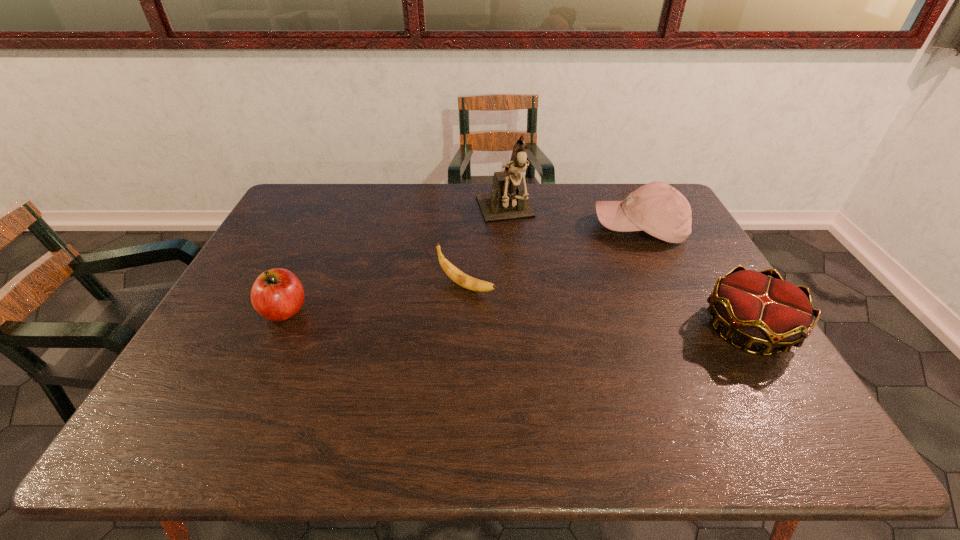
I want to click on baseball cap that is positioned at the right edge, so click(x=657, y=208).

At what (x,y) coordinates should I click in order to perform the action: click on object present at the far right corner. Please return your answer as a coordinate pair (x, y). The height and width of the screenshot is (540, 960). Looking at the image, I should click on (657, 208).

Find the location of a particular element. The width and height of the screenshot is (960, 540). free space at the far edge is located at coordinates (384, 198).

I want to click on free space at the near edge of the desktop, so click(361, 390).

I want to click on free region at the left edge of the desktop, so [313, 222].

Where is `free location at the near left corner of the desktop`? free location at the near left corner of the desktop is located at coordinates (192, 382).

In the image, there is a desktop. Where is `vacant space at the far right corner`? vacant space at the far right corner is located at coordinates (625, 186).

Find the location of a particular element. The image size is (960, 540). free space between the banana and the crown is located at coordinates (608, 307).

Where is `free spot between the banana and the apple`? Image resolution: width=960 pixels, height=540 pixels. free spot between the banana and the apple is located at coordinates (375, 299).

The image size is (960, 540). I want to click on vacant area that lies between the crown and the apple, so click(516, 320).